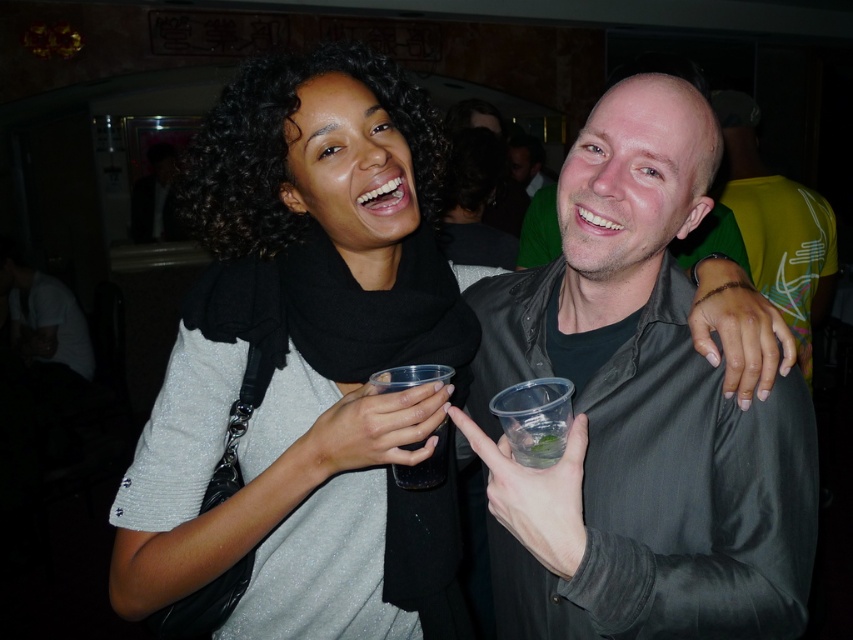
Looking at this image, you are at a party and want to find the matte gray shirt at center. Which direction should you look relative to the green matte shirt at right?

The matte gray shirt at center is located below the green matte shirt at right, so you should look downward from the green matte shirt at right to find it.

You are organizing a charity event and need to place a decorative ribbon that is 15 cm wide between the matte black scarf at center and the green matte shirt at right. Can the ribbon fit between them based on their widths?

The matte black scarf at center is narrower than the green matte shirt at right. Since the ribbon is 15 cm wide, it depends on the actual widths. However, since the scarf is narrower, if the space between them is at least 15 cm, the ribbon can fit. But without exact measurements, we can only confirm the scarf is thinner, not the distance between them.